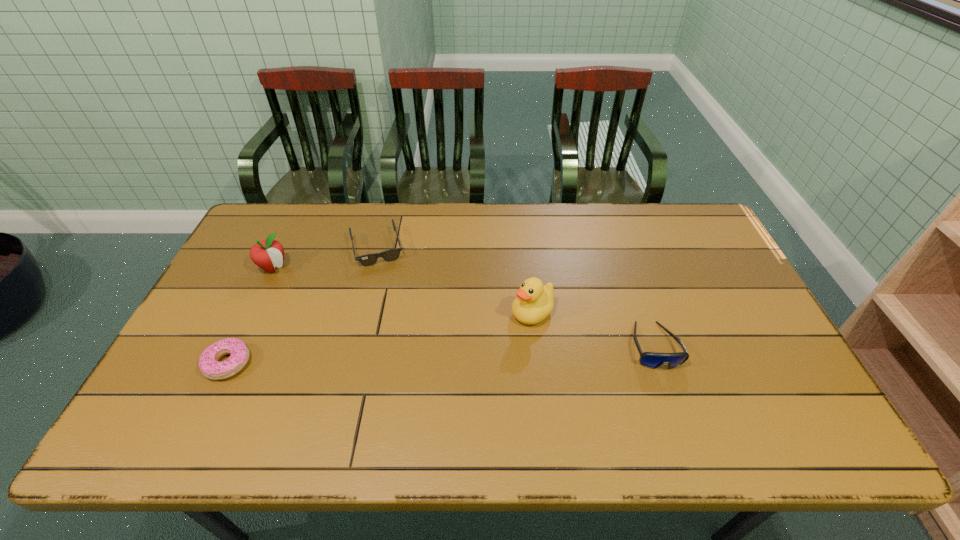
Where is `doughnut`? The height and width of the screenshot is (540, 960). doughnut is located at coordinates (209, 364).

Where is `the rightmost object`? The height and width of the screenshot is (540, 960). the rightmost object is located at coordinates (653, 360).

Image resolution: width=960 pixels, height=540 pixels. Identify the location of the nearer sunglasses. [653, 360].

I want to click on apple, so click(267, 254).

Where is `the farther sunglasses`? the farther sunglasses is located at coordinates [389, 255].

Image resolution: width=960 pixels, height=540 pixels. What are the coordinates of `the left sunglasses` in the screenshot? It's located at (389, 255).

This screenshot has width=960, height=540. In order to click on duck in this screenshot , I will do `click(534, 302)`.

This screenshot has height=540, width=960. I want to click on the tallest object, so click(x=534, y=302).

Locate an element on the screen. The height and width of the screenshot is (540, 960). vacant region located on the back of the doughnut is located at coordinates (246, 327).

Locate an element on the screen. Image resolution: width=960 pixels, height=540 pixels. free spot located on the side where a bite is taken out of the second tallest object is located at coordinates (346, 323).